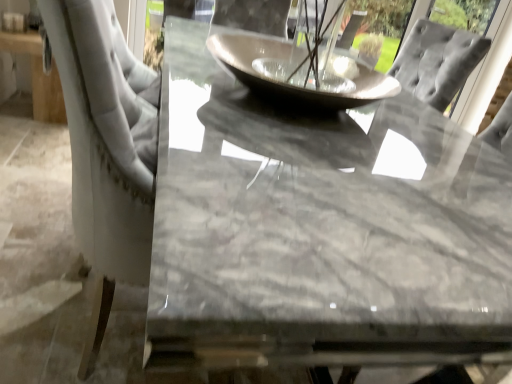
Question: Looking at the image, does matte gray glass bowl at center seem bigger or smaller compared to marble table at center?

Choices:
 (A) big
 (B) small

Answer: (B)

Question: Is point (388, 86) closer or farther from the camera than point (349, 158)?

Choices:
 (A) farther
 (B) closer

Answer: (A)

Question: Based on their positions, is matte gray glass bowl at center located to the left or right of marble table at center?

Choices:
 (A) left
 (B) right

Answer: (A)

Question: In terms of height, does marble table at center look taller or shorter compared to matte gray glass bowl at center?

Choices:
 (A) short
 (B) tall

Answer: (A)

Question: In the image, is marble table at center on the left side or the right side of matte gray glass bowl at center?

Choices:
 (A) left
 (B) right

Answer: (B)

Question: Considering the positions of point (506, 180) and point (225, 49), is point (506, 180) closer or farther from the camera than point (225, 49)?

Choices:
 (A) farther
 (B) closer

Answer: (B)

Question: From the image's perspective, is marble table at center above or below matte gray glass bowl at center?

Choices:
 (A) below
 (B) above

Answer: (A)